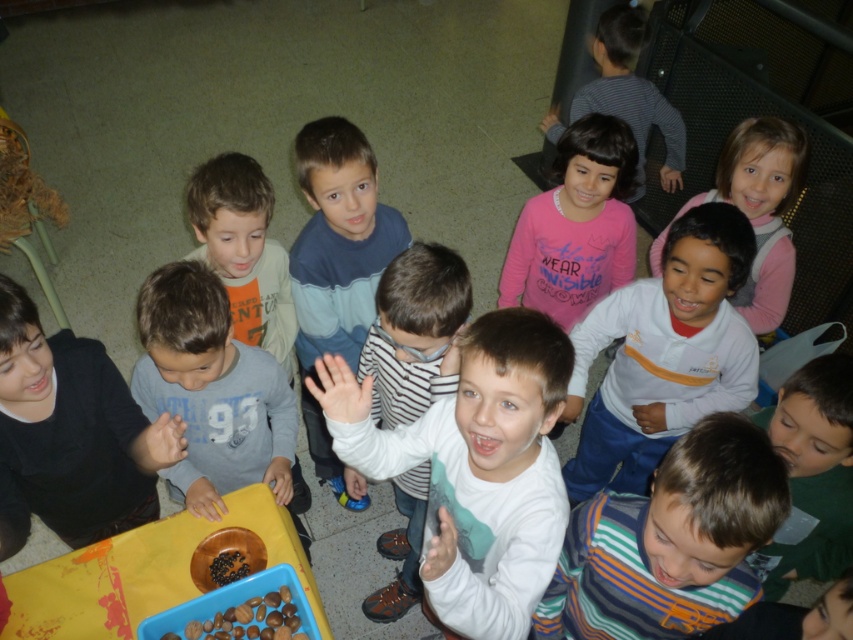
Question: Which object appears closest to the camera in this image?

Choices:
 (A) white matte shirt at center
 (B) pink fleece jacket at upper right
 (C) blue cotton shirt at center
 (D) gray cotton shirt at lower left

Answer: (A)

Question: From the image, what is the correct spatial relationship of dark gray sweater at lower left in relation to gray cotton shirt at lower left?

Choices:
 (A) below
 (B) above

Answer: (A)

Question: Which object appears farthest from the camera in this image?

Choices:
 (A) pink matte shirt at upper center
 (B) blue cotton shirt at center
 (C) white matte shirt at center
 (D) dark gray sweater at lower left

Answer: (A)

Question: Is blue cotton shirt at center above light brown striped shirt at center?

Choices:
 (A) no
 (B) yes

Answer: (A)

Question: Estimate the real-world distances between objects in this image. Which object is closer to the light brown striped shirt at center?

Choices:
 (A) striped cotton shirt at center
 (B) pink fleece jacket at upper right
 (C) white striped shirt at center

Answer: (C)

Question: Does striped cotton shirt at center appear on the right side of dark gray sweater at lower left?

Choices:
 (A) yes
 (B) no

Answer: (A)